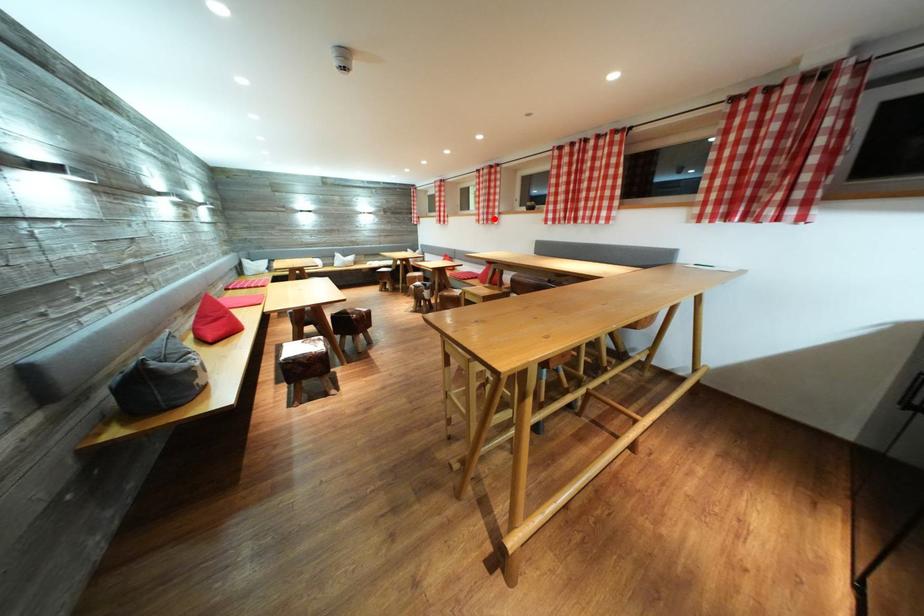
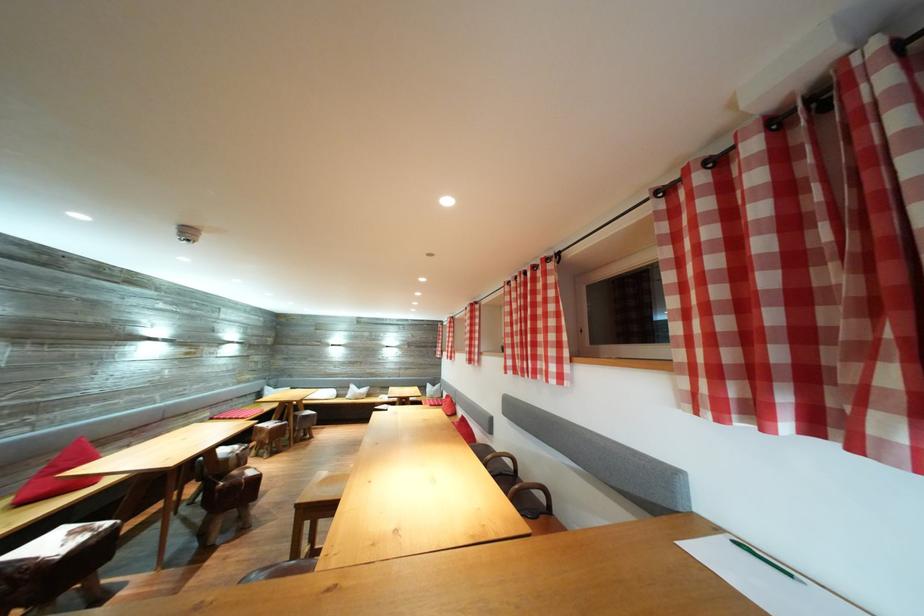
Locate, in the second image, the point that corresponds to the highlighted location in the first image.

(477, 359)